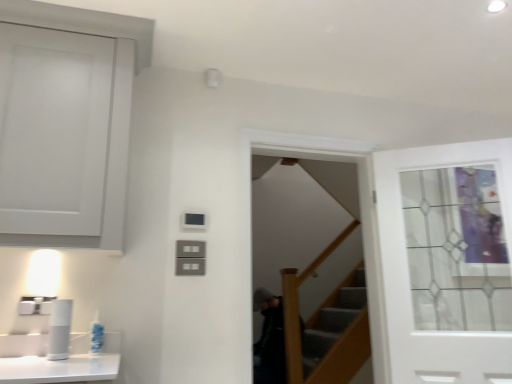
Describe the element at coordinates (312, 274) in the screenshot. I see `clear glass screen door at center` at that location.

What is the approximate width of clear glass screen door at center?

clear glass screen door at center is 8.19 inches in width.

Locate an element on the screen. This screenshot has height=384, width=512. white glass door at upper right is located at coordinates (409, 272).

Locate an element on the screen. The height and width of the screenshot is (384, 512). toiletry located in front of the white glass door at upper right is located at coordinates (96, 335).

Between white glass door at upper right and white plastic toothbrush at lower left, which one is positioned behind?

white glass door at upper right is behind.

From a real-world perspective, which is physically above, white glass door at upper right or white plastic toothbrush at lower left?

white glass door at upper right.

Is white glass door at upper right at the right side of white plastic toothbrush at lower left?

Indeed, white glass door at upper right is positioned on the right side of white plastic toothbrush at lower left.

From the picture: Can we say clear glass screen door at center lies outside white glass door at upper right?

Indeed, clear glass screen door at center is completely outside white glass door at upper right.

Considering the sizes of objects clear glass screen door at center and white glass door at upper right in the image provided, who is bigger, clear glass screen door at center or white glass door at upper right?

clear glass screen door at center is bigger.

Would you consider clear glass screen door at center to be distant from white glass door at upper right?

No.

Which of these two, clear glass screen door at center or white glass door at upper right, stands shorter?

white glass door at upper right.

Considering the relative sizes of clear glass screen door at center and white plastic toothbrush at lower left in the image provided, is clear glass screen door at center shorter than white plastic toothbrush at lower left?

Incorrect, the height of clear glass screen door at center does not fall short of that of white plastic toothbrush at lower left.

Considering the relative sizes of clear glass screen door at center and white plastic toothbrush at lower left in the image provided, is clear glass screen door at center thinner than white plastic toothbrush at lower left?

Incorrect, the width of clear glass screen door at center is not less than that of white plastic toothbrush at lower left.

From a real-world perspective, is clear glass screen door at center physically located above or below white plastic toothbrush at lower left?

From a real-world perspective, clear glass screen door at center is physically above white plastic toothbrush at lower left.

Is white plastic toothbrush at lower left not close to clear glass screen door at center?

Indeed, white plastic toothbrush at lower left is not near clear glass screen door at center.

Consider the image. Which object is positioned more to the right, white plastic toothbrush at lower left or clear glass screen door at center?

clear glass screen door at center is more to the right.

Where is `toiletry that appears below the clear glass screen door at center (from a real-world perspective)`? The height and width of the screenshot is (384, 512). toiletry that appears below the clear glass screen door at center (from a real-world perspective) is located at coordinates (96, 335).

Does white plastic toothbrush at lower left lie in front of clear glass screen door at center?

Yes, it is.

From a real-world perspective, who is located lower, white glass door at upper right or clear glass screen door at center?

In real-world perspective, white glass door at upper right is lower.

Based on their sizes in the image, would you say white glass door at upper right is bigger or smaller than clear glass screen door at center?

Clearly, white glass door at upper right is smaller in size than clear glass screen door at center.

This screenshot has width=512, height=384. I want to click on door on the right of the clear glass screen door at center, so click(409, 272).

Does white glass door at upper right touch clear glass screen door at center?

No, white glass door at upper right is not touching clear glass screen door at center.

Is white plastic toothbrush at lower left inside the boundaries of white glass door at upper right, or outside?

white plastic toothbrush at lower left lies outside white glass door at upper right.

From the image's perspective, is white plastic toothbrush at lower left above or below white glass door at upper right?

white plastic toothbrush at lower left is below white glass door at upper right.

Does white plastic toothbrush at lower left come behind white glass door at upper right?

No, it is in front of white glass door at upper right.

Considering the relative sizes of white plastic toothbrush at lower left and white glass door at upper right in the image provided, is white plastic toothbrush at lower left shorter than white glass door at upper right?

Correct, white plastic toothbrush at lower left is not as tall as white glass door at upper right.

Where is `door positioned vertically above the white plastic toothbrush at lower left (from a real-world perspective)`? door positioned vertically above the white plastic toothbrush at lower left (from a real-world perspective) is located at coordinates (409, 272).

In order to click on screen door behind the white glass door at upper right in this screenshot , I will do `click(312, 274)`.

Which object lies nearer to the anchor point clear glass screen door at center, white glass door at upper right or white plastic toothbrush at lower left?

white glass door at upper right lies closer to clear glass screen door at center than the other object.

Looking at the image, which one is located closer to white plastic toothbrush at lower left, clear glass screen door at center or white glass door at upper right?

white glass door at upper right is closer to white plastic toothbrush at lower left.

Based on their spatial positions, is white glass door at upper right or clear glass screen door at center closer to white plastic toothbrush at lower left?

The object closer to white plastic toothbrush at lower left is white glass door at upper right.

Based on their spatial positions, is white plastic toothbrush at lower left or clear glass screen door at center closer to white glass door at upper right?

clear glass screen door at center.

In the scene shown: Considering their positions, is white plastic toothbrush at lower left positioned closer to clear glass screen door at center than white glass door at upper right?

white glass door at upper right.

Based on their spatial positions, is clear glass screen door at center or white plastic toothbrush at lower left closer to white glass door at upper right?

clear glass screen door at center lies closer to white glass door at upper right than the other object.

In order to click on screen door between white plastic toothbrush at lower left and white glass door at upper right in the horizontal direction in this screenshot , I will do `click(312, 274)`.